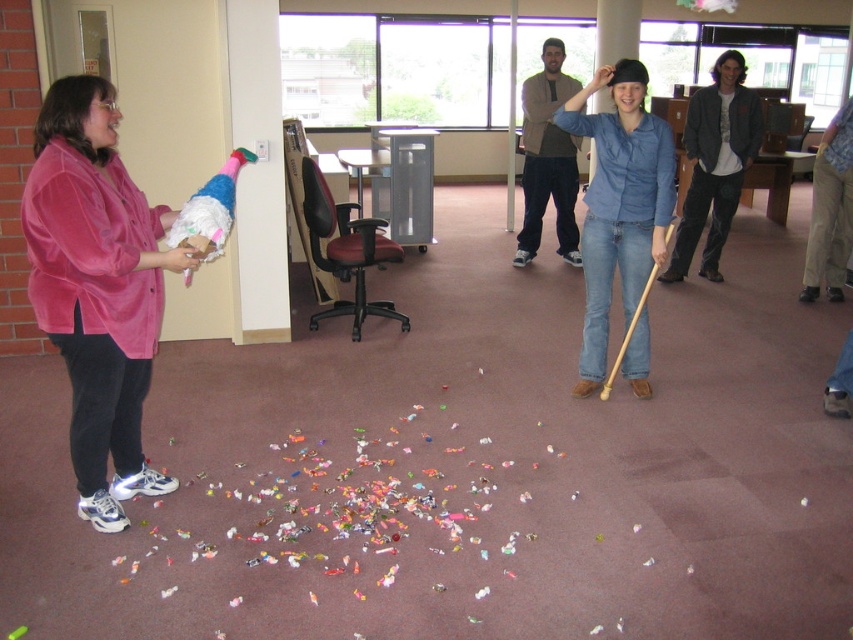
Between velvet pink jacket at left and denim shirt at center, which one appears on the right side from the viewer's perspective?

From the viewer's perspective, denim shirt at center appears more on the right side.

Is velvet pink jacket at left closer to the viewer compared to denim shirt at center?

Yes, it is in front of denim shirt at center.

Between point (47, 224) and point (643, 275), which one is positioned behind?

Point (643, 275)

The image size is (853, 640). Identify the location of velvet pink jacket at left. (97, 289).